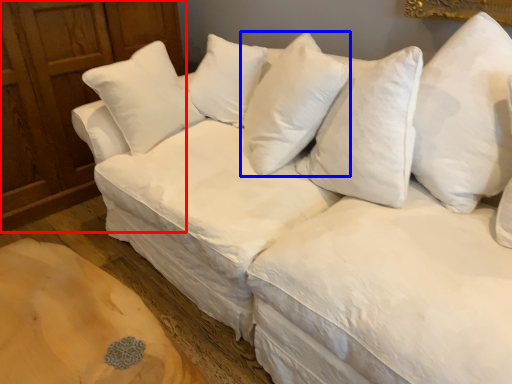
Question: Which point is closer to the camera, dresser (highlighted by a red box) or pillow (highlighted by a blue box)?

Choices:
 (A) dresser
 (B) pillow

Answer: (B)